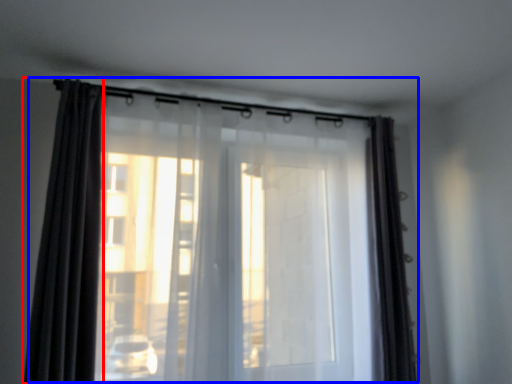
Question: Among these objects, which one is nearest to the camera, curtain (highlighted by a red box) or curtain (highlighted by a blue box)?

Choices:
 (A) curtain
 (B) curtain

Answer: (A)